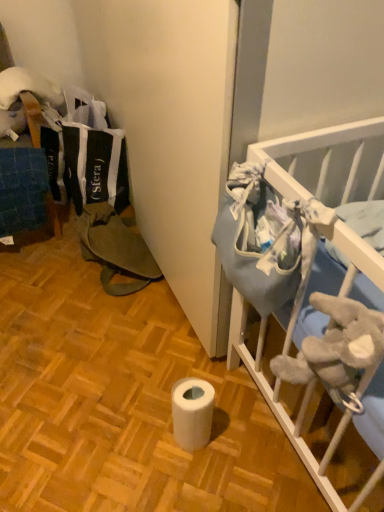
You are a GUI agent. You are given a task and a screenshot of the screen. Output one action in this format:
    pyautogui.click(x=<x>, y=<y>)
    Task: Click on the vacant location behind white matte toilet paper at center
    This screenshot has width=384, height=512.
    Given the screenshot: What is the action you would take?
    pyautogui.click(x=189, y=376)